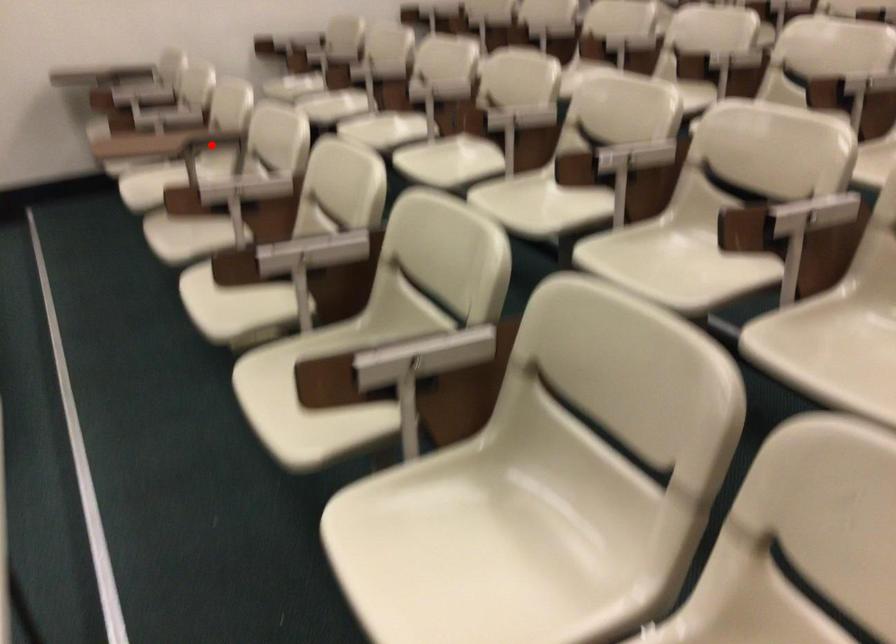
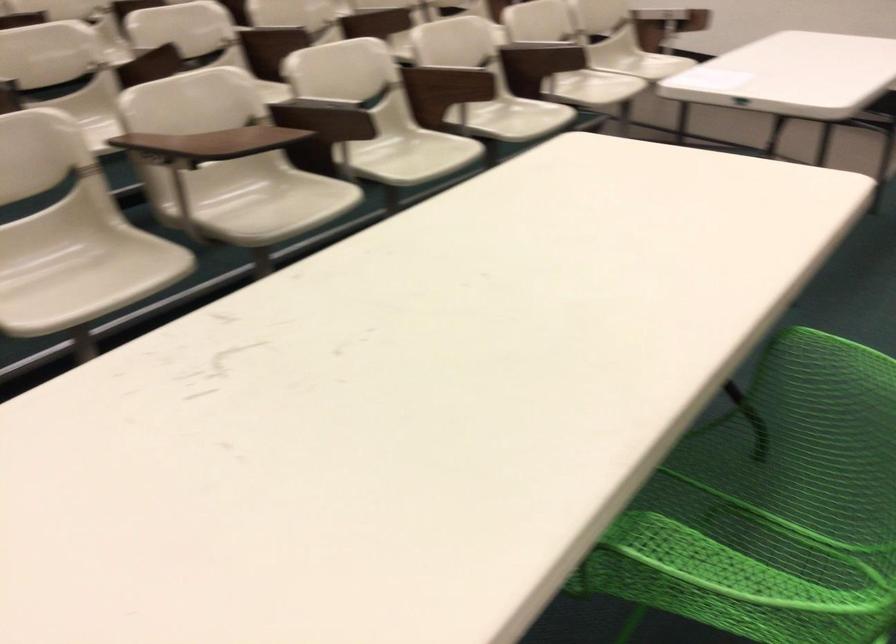
Find the pixel in the second image that matches the highlighted location in the first image.

(174, 147)